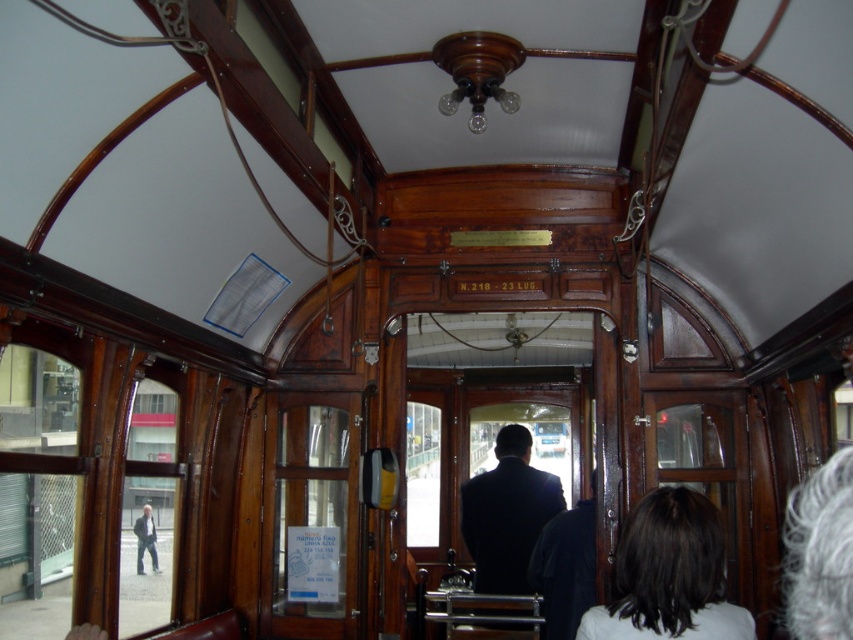
In the scene shown: Is gray hair at upper right in front of dark suit coat at center?

Yes, gray hair at upper right is in front of dark suit coat at center.

Is gray hair at upper right positioned behind dark suit coat at center?

No.

Who is more forward, (798, 602) or (538, 490)?

Positioned in front is point (798, 602).

Locate an element on the screen. The width and height of the screenshot is (853, 640). gray hair at upper right is located at coordinates (819, 552).

Who is taller, gray hair at upper right or light gray fabric jacket at left?

With more height is gray hair at upper right.

Can you confirm if gray hair at upper right is positioned above light gray fabric jacket at left?

No.

Between point (833, 460) and point (144, 525), which one is positioned behind?

The point (144, 525) is more distant.

Locate an element on the screen. Image resolution: width=853 pixels, height=640 pixels. gray hair at upper right is located at coordinates point(819,552).

Does dark brown hair at lower right appear over dark suit coat at center?

Correct, dark brown hair at lower right is located above dark suit coat at center.

Can you confirm if dark brown hair at lower right is thinner than dark suit coat at center?

Correct, dark brown hair at lower right's width is less than dark suit coat at center's.

Does point (665, 547) come farther from viewer compared to point (508, 465)?

That is False.

Identify the location of dark brown hair at lower right. The height and width of the screenshot is (640, 853). (668, 576).